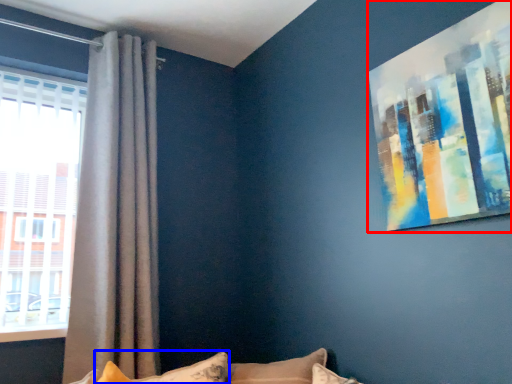
Question: Which object appears farthest to the camera in this image, picture frame (highlighted by a red box) or pillow (highlighted by a blue box)?

Choices:
 (A) picture frame
 (B) pillow

Answer: (B)